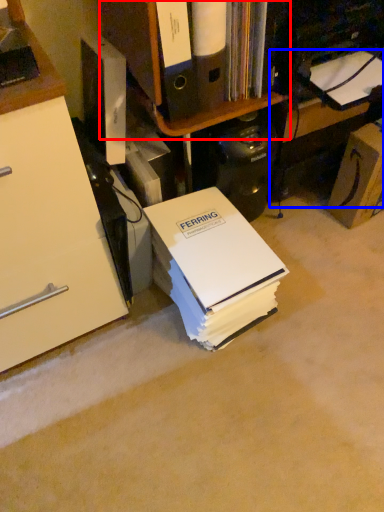
Question: Which of the following is the farthest to the observer, shelf (highlighted by a red box) or computer desk (highlighted by a blue box)?

Choices:
 (A) shelf
 (B) computer desk

Answer: (B)